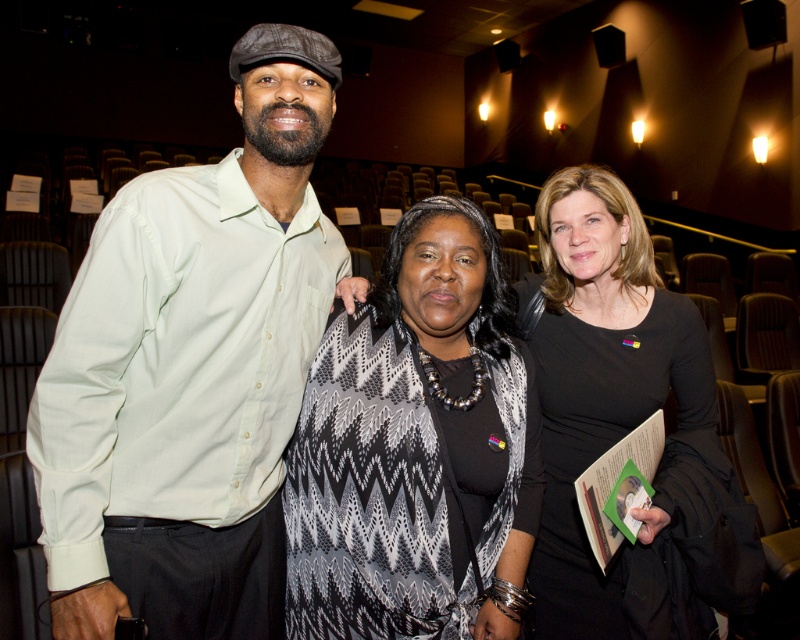
Question: Can you confirm if matte green shirt at center is bigger than black and white zigzag scarf at center?

Choices:
 (A) no
 (B) yes

Answer: (B)

Question: Does matte green shirt at center appear under black matte dress at center?

Choices:
 (A) yes
 (B) no

Answer: (B)

Question: Which point is closer to the camera?

Choices:
 (A) black and white zigzag scarf at center
 (B) matte green shirt at center

Answer: (B)

Question: Which point appears farthest from the camera in this image?

Choices:
 (A) (508, 433)
 (B) (108, 563)

Answer: (A)

Question: Does black and white zigzag scarf at center appear over black matte dress at center?

Choices:
 (A) no
 (B) yes

Answer: (A)

Question: Among these objects, which one is farthest from the camera?

Choices:
 (A) black matte dress at center
 (B) black and white zigzag scarf at center
 (C) matte green shirt at center

Answer: (A)